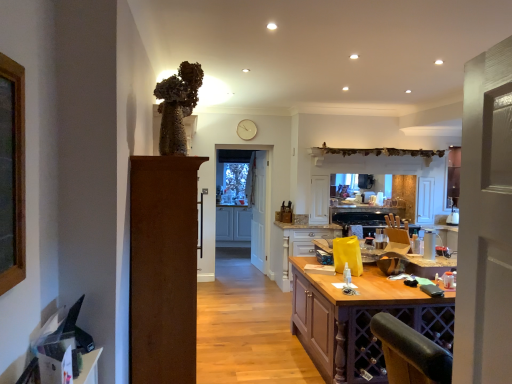
Locate an element on the screen. vacant area situated to the left side of white plastic spray bottle at center is located at coordinates (412, 257).